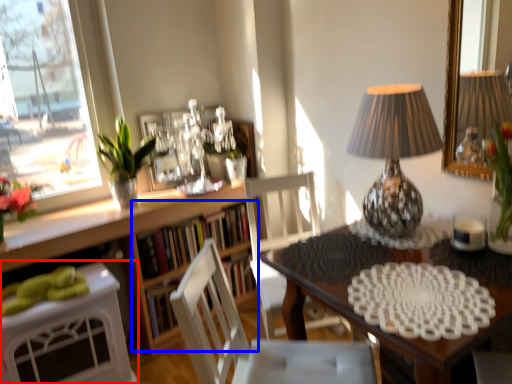
Question: Which of the following is the farthest to the observer, desk (highlighted by a red box) or shelf (highlighted by a blue box)?

Choices:
 (A) desk
 (B) shelf

Answer: (B)